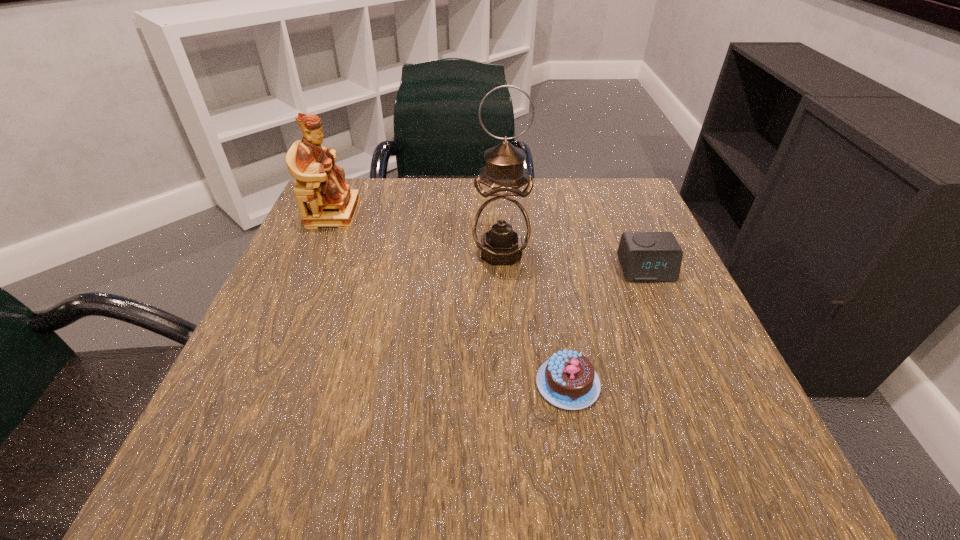
What are the coordinates of `vacant space located on the front of the chocolate cake` in the screenshot? It's located at (579, 446).

Identify the location of object located in the far edge section of the desktop. The width and height of the screenshot is (960, 540). (332, 203).

This screenshot has height=540, width=960. What are the coordinates of `object present at the left edge` in the screenshot? It's located at (332, 203).

This screenshot has height=540, width=960. Identify the location of object that is at the right edge. (644, 256).

Where is `object situated at the far left corner`? object situated at the far left corner is located at coordinates (332, 203).

Identify the location of free space at the far edge of the desktop. The image size is (960, 540). (430, 228).

Image resolution: width=960 pixels, height=540 pixels. Identify the location of vacant space at the near edge of the desktop. (416, 422).

This screenshot has height=540, width=960. In the image, there is a desktop. Identify the location of free space at the left edge. [x=317, y=392].

I want to click on free space at the right edge of the desktop, so click(664, 325).

I want to click on free space at the far left corner, so click(x=332, y=233).